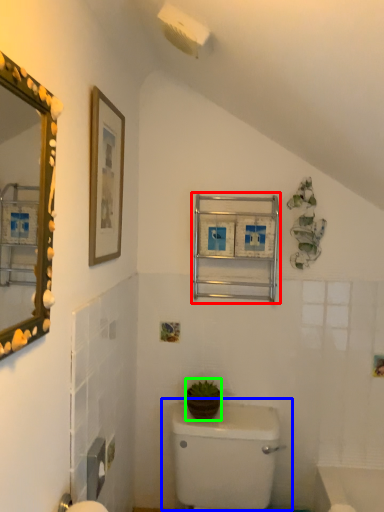
Question: Estimate the real-world distances between objects in this image. Which object is farther from medicine cabinet (highlighted by a red box), toilet (highlighted by a blue box) or plant (highlighted by a green box)?

Choices:
 (A) toilet
 (B) plant

Answer: (A)